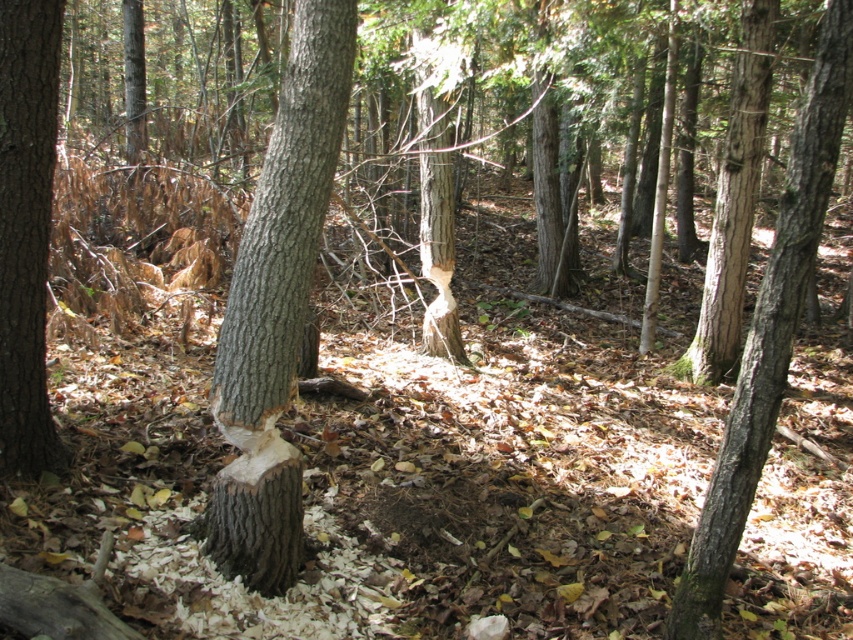
Is smooth gray bark at center behind smooth brown bark at left?

No.

Between smooth gray bark at center and smooth brown bark at left, which one has less height?

With less height is smooth brown bark at left.

What do you see at coordinates (276, 307) in the screenshot?
I see `smooth gray bark at center` at bounding box center [276, 307].

At what (x,y) coordinates should I click in order to perform the action: click on smooth gray bark at center. Please return your answer as a coordinate pair (x, y). Image resolution: width=853 pixels, height=640 pixels. Looking at the image, I should click on (276, 307).

Is smooth bark tree at center bigger than smooth brown bark at left?

Yes, smooth bark tree at center is bigger than smooth brown bark at left.

Is smooth bark tree at center taller than smooth brown bark at left?

Indeed, smooth bark tree at center has a greater height compared to smooth brown bark at left.

Who is more distant from viewer, [766,307] or [1,348]?

Point [1,348]

This screenshot has height=640, width=853. I want to click on smooth bark tree at center, so click(x=769, y=333).

Which of these two, smooth gray bark at center or smooth bark tree at center, stands taller?

With more height is smooth gray bark at center.

Which is above, smooth gray bark at center or smooth bark tree at center?

smooth gray bark at center is higher up.

Is point (234, 477) farther from camera compared to point (701, 572)?

Yes, it is.

Identify the location of smooth gray bark at center. The width and height of the screenshot is (853, 640). (276, 307).